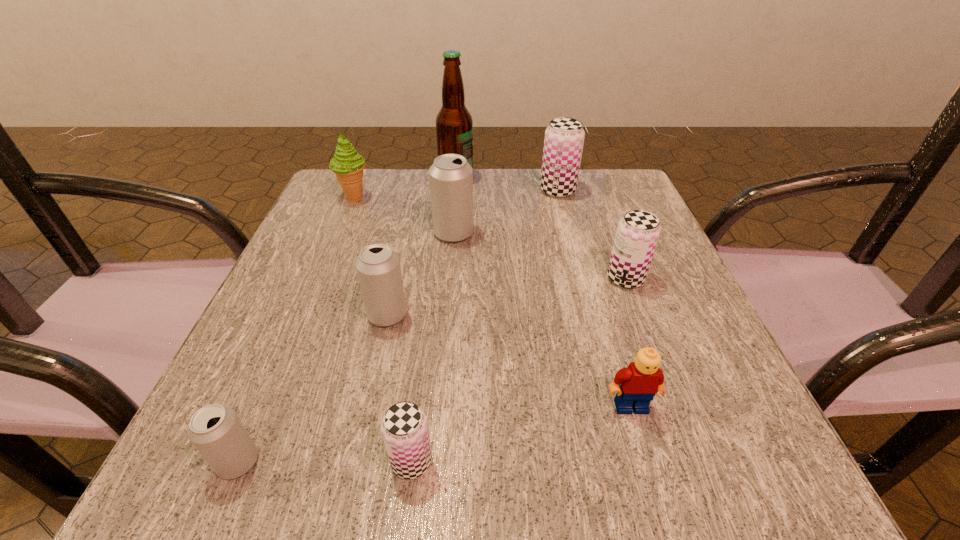
The image size is (960, 540). In the image, there is a desktop. Find the location of `vacant space at the near right corner`. vacant space at the near right corner is located at coordinates (719, 498).

The height and width of the screenshot is (540, 960). In order to click on vacant point located between the rightmost white beer can and the leftmost white beer can in this screenshot , I will do `click(346, 347)`.

I want to click on free space between the farthest white beer can and the second purple beer can from right to left, so coord(506,212).

Locate an element on the screen. This screenshot has width=960, height=540. free space between the brown beer bottle and the nearest white beer can is located at coordinates (348, 320).

I want to click on vacant space that is in between the farthest white beer can and the biggest purple beer can, so click(506, 212).

Where is `free point between the fifth nearest beer can and the fifth beer can from right to left`? free point between the fifth nearest beer can and the fifth beer can from right to left is located at coordinates (420, 274).

The image size is (960, 540). I want to click on free space between the fifth nearest beer can and the nearest white beer can, so click(x=346, y=347).

Where is `vacant space that's between the yellow Lego and the leftmost white beer can`? This screenshot has width=960, height=540. vacant space that's between the yellow Lego and the leftmost white beer can is located at coordinates (434, 434).

Image resolution: width=960 pixels, height=540 pixels. I want to click on free spot between the third nearest object and the second purple beer can from right to left, so click(594, 299).

At what (x,y) coordinates should I click in order to perform the action: click on free space between the second purple beer can from right to left and the farthest white beer can. Please return your answer as a coordinate pair (x, y). This screenshot has width=960, height=540. Looking at the image, I should click on (506, 212).